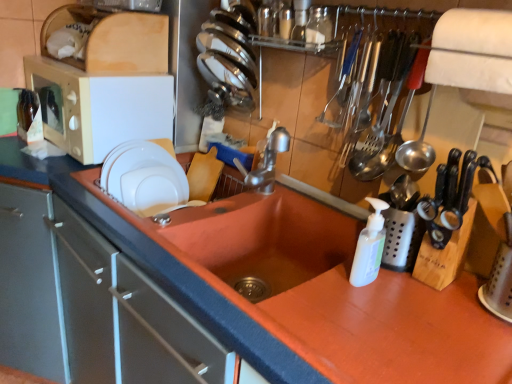
Question: Based on their positions, is transparent glass jar at upper center, which is counted as the 1th bottle, starting from the top, located to the left or right of matte white drawer at left?

Choices:
 (A) right
 (B) left

Answer: (A)

Question: From the image's perspective, is transparent glass jar at upper center, the second bottle in the bottom-to-top sequence, located above or below matte white drawer at left?

Choices:
 (A) above
 (B) below

Answer: (A)

Question: Which object is positioned closest to the translucent amber glass at upper left, the first bottle from the left?

Choices:
 (A) matte white microwave at left
 (B) white matte plate at upper left, the first tableware in the bottom-to-top sequence
 (C) matte white drawer at left
 (D) metallic silverware at upper right
 (E) shiny stainless steel plates at upper center, acting as the 1th tableware starting from the top

Answer: (A)

Question: Estimate the real-world distances between objects in this image. Which object is farther from the translucent amber glass at upper left, arranged as the second bottle when viewed from the top?

Choices:
 (A) metallic silverware at upper right
 (B) white fabric exhaust hood at upper right
 (C) matte white drawer at left
 (D) shiny stainless steel plates at upper center, positioned as the first tableware in right-to-left order
 (E) white matte plate at upper left, which ranks as the 2th tableware in top-to-bottom order

Answer: (B)